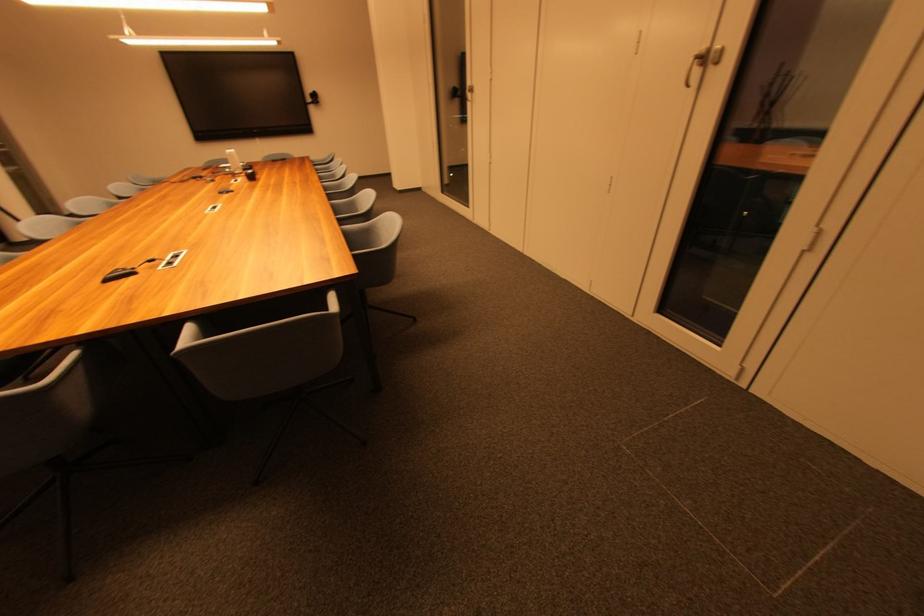
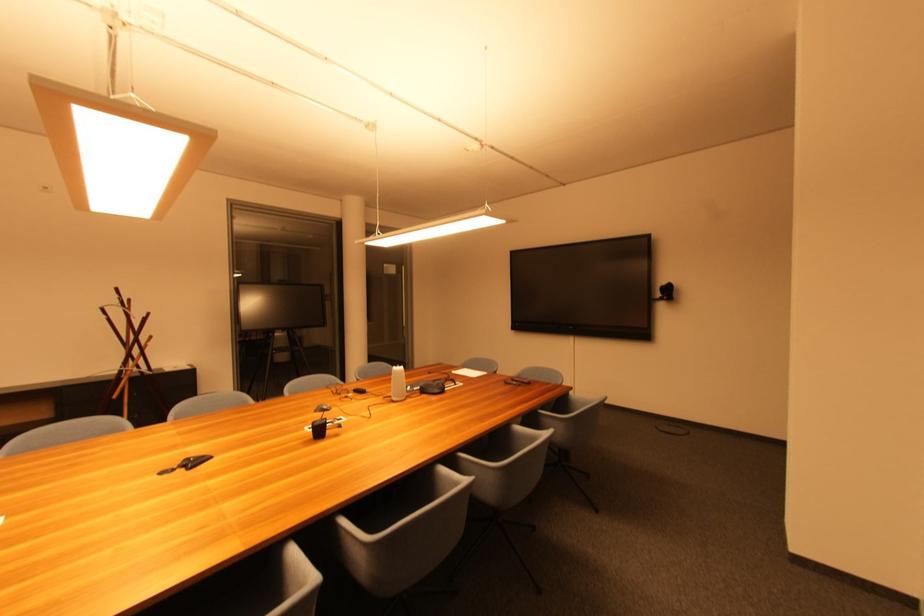
Locate, in the second image, the point that corresponds to point (320, 100) in the first image.

(673, 292)